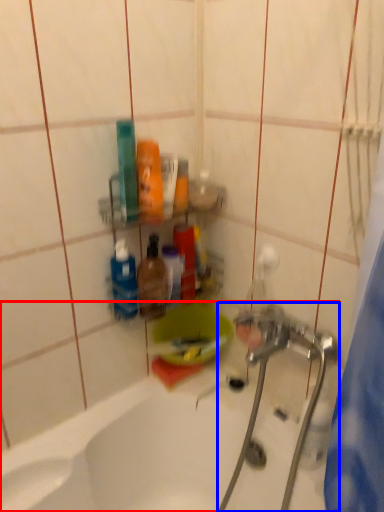
Question: Among these objects, which one is nearest to the camera, bathtub (highlighted by a red box) or plumbing fixture (highlighted by a blue box)?

Choices:
 (A) bathtub
 (B) plumbing fixture

Answer: (A)